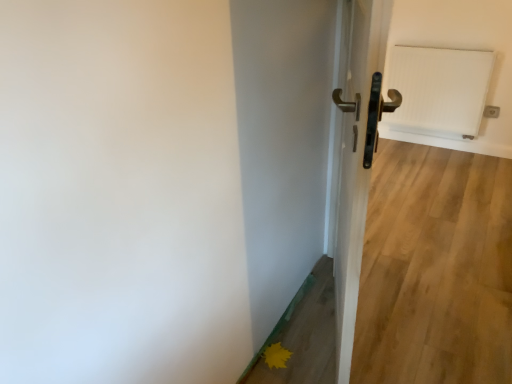
Where is `vacant space underneath white textured radiator at upper right (from a real-world perspective)`? Image resolution: width=512 pixels, height=384 pixels. vacant space underneath white textured radiator at upper right (from a real-world perspective) is located at coordinates tap(417, 144).